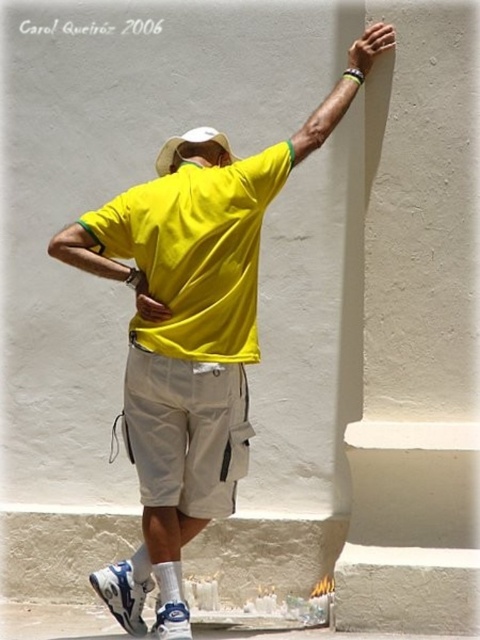
You are a photographer trying to capture the man in the scene. You notice the matte yellow arm at upper right and the white matte hand at upper right in your frame. Which object is positioned lower in the image?

The matte yellow arm at upper right is located below the white matte hand at upper right, so the matte yellow arm at upper right is positioned lower in the image.

You are a photographer setting up a shoot. You need to position a reflector to the left of the yellow matte shirt at center and to the right of the white matte baseball hat at back. Is this possible based on their current positions?

The yellow matte shirt at center is to the right of the white matte baseball hat at back, so placing a reflector to the left of the yellow matte shirt at center and to the right of the white matte baseball hat at back is possible as they are positioned in a way that allows space between them.

You are a photographer adjusting your camera settings to capture the man in the scene. You notice a specific point marked at coordinates (342,92). Which part of the man is located at this coordinate?

The point at coordinates (342,92) corresponds to the matte yellow arm at upper right.